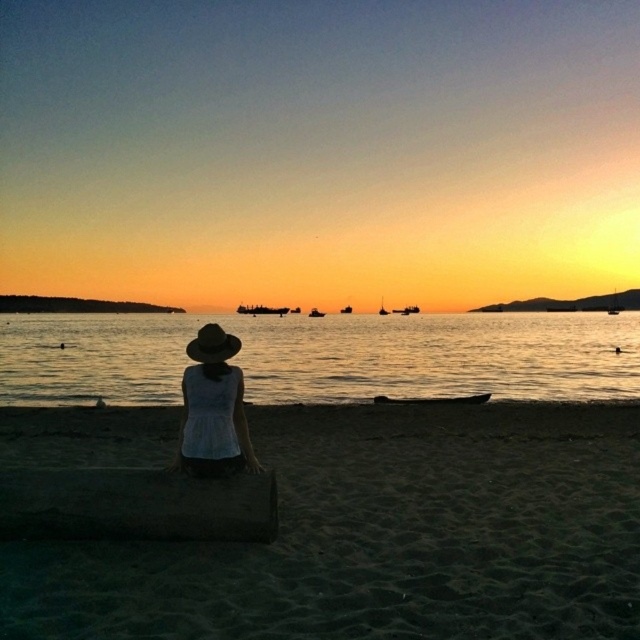
Question: Can you confirm if smooth wooden canoe at center is wider than metallic gray ship at center?

Choices:
 (A) no
 (B) yes

Answer: (A)

Question: Which of these objects is positioned farthest from the sandy at lower center?

Choices:
 (A) white matte hat at center
 (B) metallic gray ship at center
 (C) smooth wooden canoe at center

Answer: (B)

Question: Can you confirm if smooth wooden canoe at center is thinner than metallic silver boat at center?

Choices:
 (A) no
 (B) yes

Answer: (B)

Question: Which of the following is the farthest from the observer?

Choices:
 (A) (280, 314)
 (B) (413, 400)
 (C) (420, 376)
 (D) (316, 307)

Answer: (D)

Question: Does smooth wooden canoe at center have a larger size compared to metallic silver boat at center?

Choices:
 (A) no
 (B) yes

Answer: (A)

Question: Which point is farther from the camera taking this photo?

Choices:
 (A) (244, 305)
 (B) (321, 388)

Answer: (A)